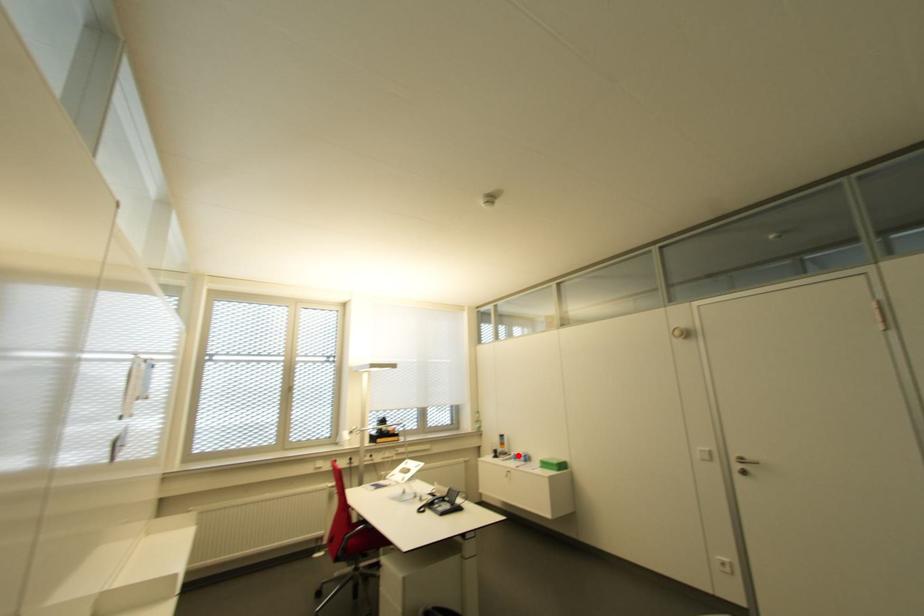
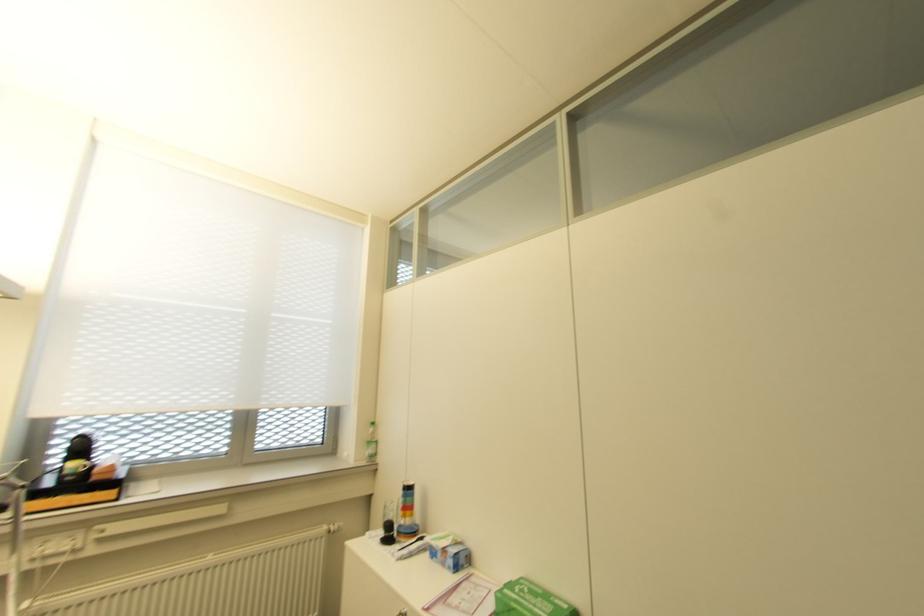
Question: I am providing you with two images of the same scene from different viewpoints. A red point is shown in image1. For the corresponding object point in image2, is it positioned nearer or farther from the camera?

Choices:
 (A) Nearer
 (B) Farther

Answer: (A)